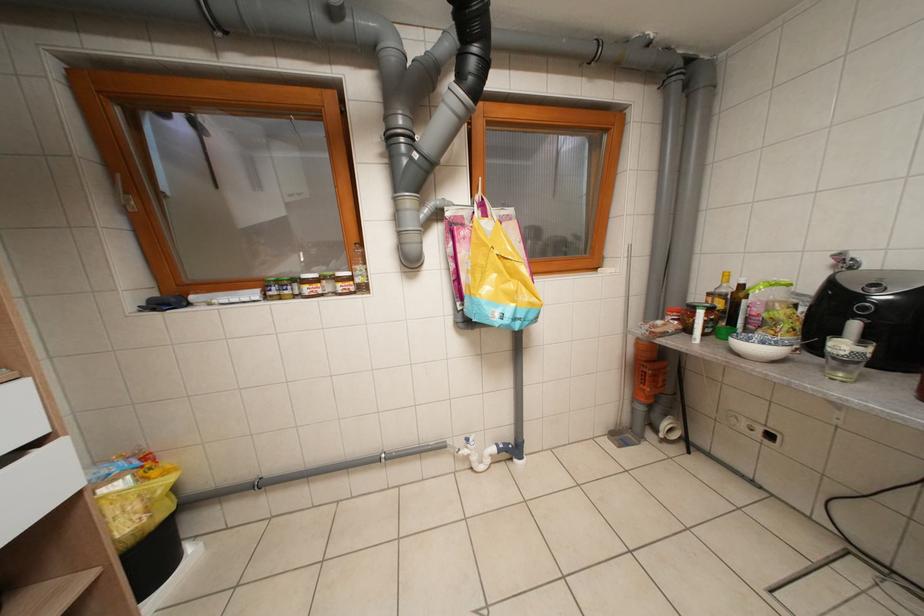
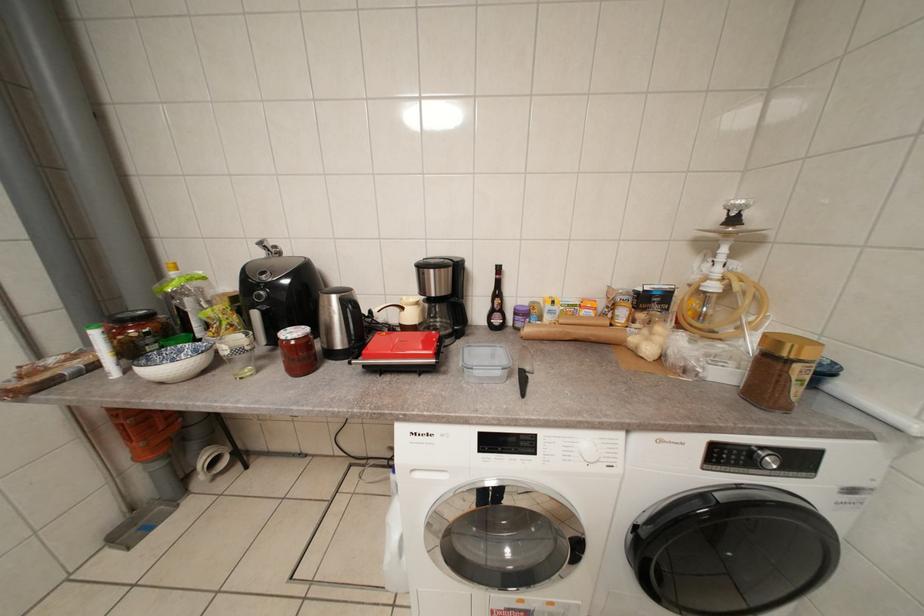
Question: The first image is from the beginning of the video and the second image is from the end. How did the camera likely rotate when shooting the video?

Choices:
 (A) Left
 (B) Right
 (C) Up
 (D) Down

Answer: (B)